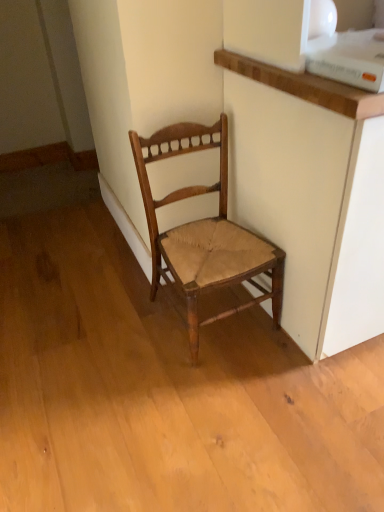
Identify the location of vacant region in front of wooden woven seat chair at center. The image size is (384, 512). (229, 395).